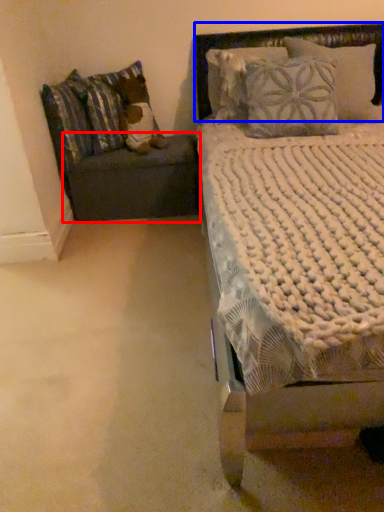
Question: Which object appears farthest to the camera in this image, table (highlighted by a red box) or headboard (highlighted by a blue box)?

Choices:
 (A) table
 (B) headboard

Answer: (A)